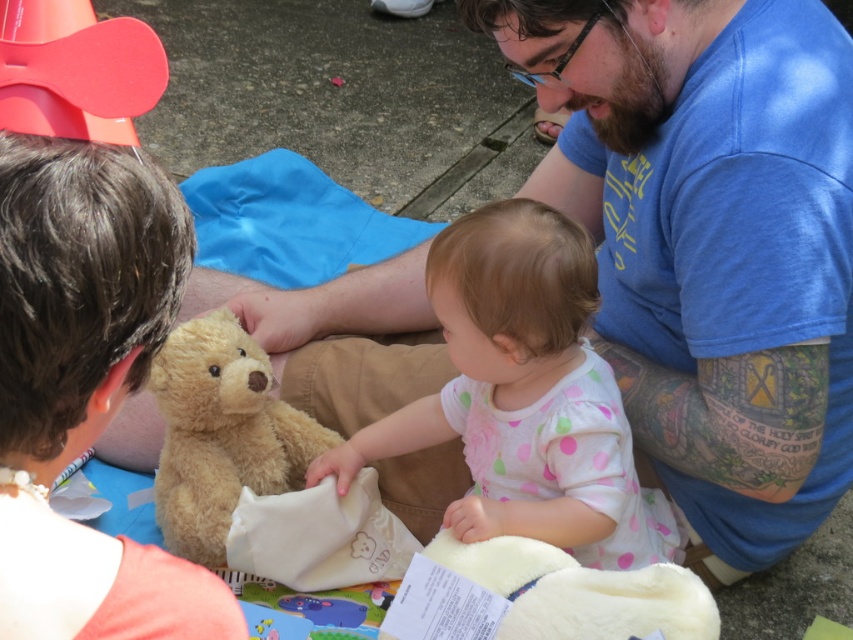
Question: Does soft white fabric at center lie in front of fuzzy beige teddy bear at center?

Choices:
 (A) yes
 (B) no

Answer: (A)

Question: Is soft white fabric at center below fuzzy beige teddy bear at center?

Choices:
 (A) yes
 (B) no

Answer: (A)

Question: Among these points, which one is farthest from the camera?

Choices:
 (A) (219, 545)
 (B) (529, 234)
 (C) (694, 493)

Answer: (C)

Question: Estimate the real-world distances between objects in this image. Which object is farther from the soft white fabric at center?

Choices:
 (A) fuzzy beige teddy bear at center
 (B) blue cotton shirt at center

Answer: (A)

Question: Which point appears closest to the camera in this image?

Choices:
 (A) (207, 488)
 (B) (593, 356)

Answer: (B)

Question: Can you confirm if blue cotton shirt at center is bigger than soft white fabric at center?

Choices:
 (A) yes
 (B) no

Answer: (A)